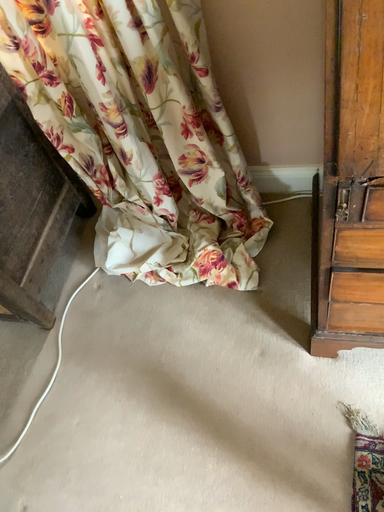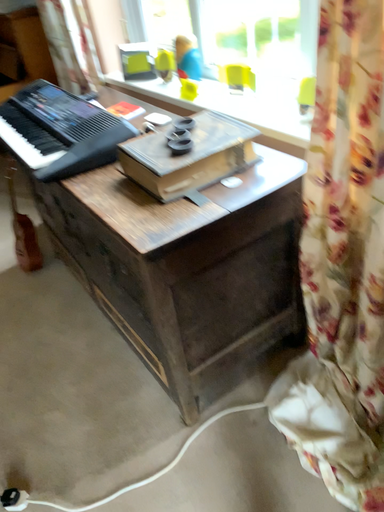
Question: How did the camera likely rotate when shooting the video?

Choices:
 (A) rotated left
 (B) rotated right

Answer: (A)